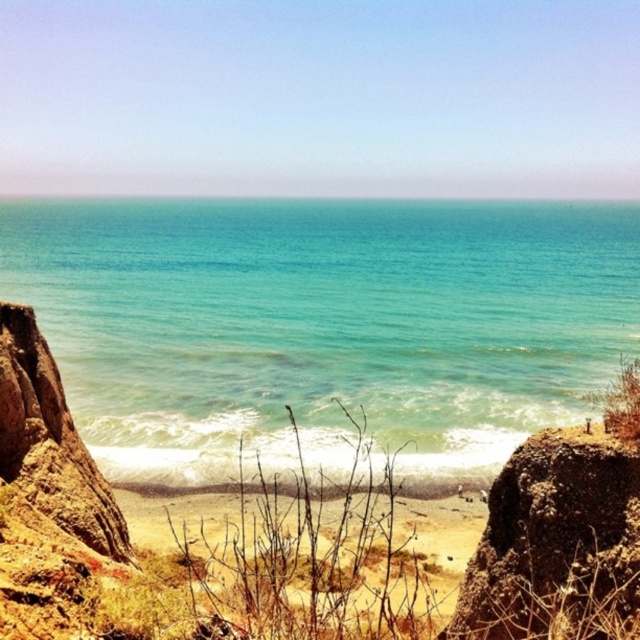
Can you confirm if clear blue water at center is thinner than brown rough rock at lower right?

Incorrect, clear blue water at center's width is not less than brown rough rock at lower right's.

Measure the distance between point (172, 340) and camera.

264.64 feet

This screenshot has width=640, height=640. Describe the element at coordinates (323, 324) in the screenshot. I see `clear blue water at center` at that location.

Find the location of a particular element. clear blue water at center is located at coordinates pyautogui.click(x=323, y=324).